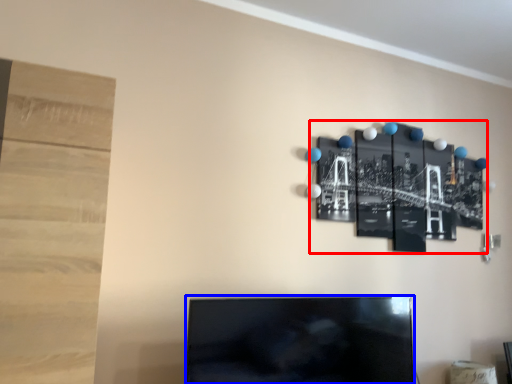
Question: Which of the following is the farthest to the observer, bulletin board (highlighted by a red box) or television (highlighted by a blue box)?

Choices:
 (A) bulletin board
 (B) television

Answer: (A)